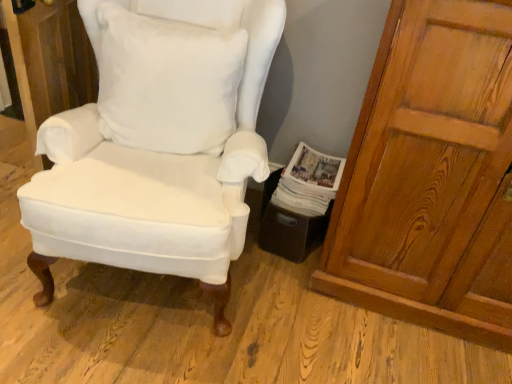
Question: Is white paper magazine at lower right behind white cotton pillow at center?

Choices:
 (A) no
 (B) yes

Answer: (B)

Question: Does white paper magazine at lower right have a larger size compared to white cotton pillow at center?

Choices:
 (A) yes
 (B) no

Answer: (B)

Question: From a real-world perspective, is white paper magazine at lower right under white cotton pillow at center?

Choices:
 (A) yes
 (B) no

Answer: (A)

Question: Considering the relative positions of white paper magazine at lower right and white cotton pillow at center in the image provided, is white paper magazine at lower right to the right of white cotton pillow at center from the viewer's perspective?

Choices:
 (A) yes
 (B) no

Answer: (A)

Question: Is white paper magazine at lower right touching white cotton pillow at center?

Choices:
 (A) yes
 (B) no

Answer: (B)

Question: Looking at their shapes, would you say white paper magazine at lower right is wider or thinner than matte white cushioned chair at center?

Choices:
 (A) wide
 (B) thin

Answer: (B)

Question: Is point (334, 160) positioned closer to the camera than point (241, 203)?

Choices:
 (A) farther
 (B) closer

Answer: (A)

Question: Which is correct: white paper magazine at lower right is inside matte white cushioned chair at center, or outside of it?

Choices:
 (A) outside
 (B) inside

Answer: (A)

Question: In the image, is white paper magazine at lower right on the left side or the right side of matte white cushioned chair at center?

Choices:
 (A) left
 (B) right

Answer: (B)

Question: Considering the positions of point (501, 21) and point (102, 253), is point (501, 21) closer or farther from the camera than point (102, 253)?

Choices:
 (A) closer
 (B) farther

Answer: (A)

Question: Looking at the image, does wooden door at right seem bigger or smaller compared to matte white cushioned chair at center?

Choices:
 (A) big
 (B) small

Answer: (B)

Question: Relative to matte white cushioned chair at center, is wooden door at right in front or behind?

Choices:
 (A) behind
 (B) front

Answer: (A)

Question: Visually, is wooden door at right positioned to the left or to the right of matte white cushioned chair at center?

Choices:
 (A) right
 (B) left

Answer: (A)

Question: From the image's perspective, is matte white cushioned chair at center above or below wooden door at right?

Choices:
 (A) below
 (B) above

Answer: (B)

Question: Considering their positions, is matte white cushioned chair at center located in front of or behind wooden door at right?

Choices:
 (A) behind
 (B) front

Answer: (B)